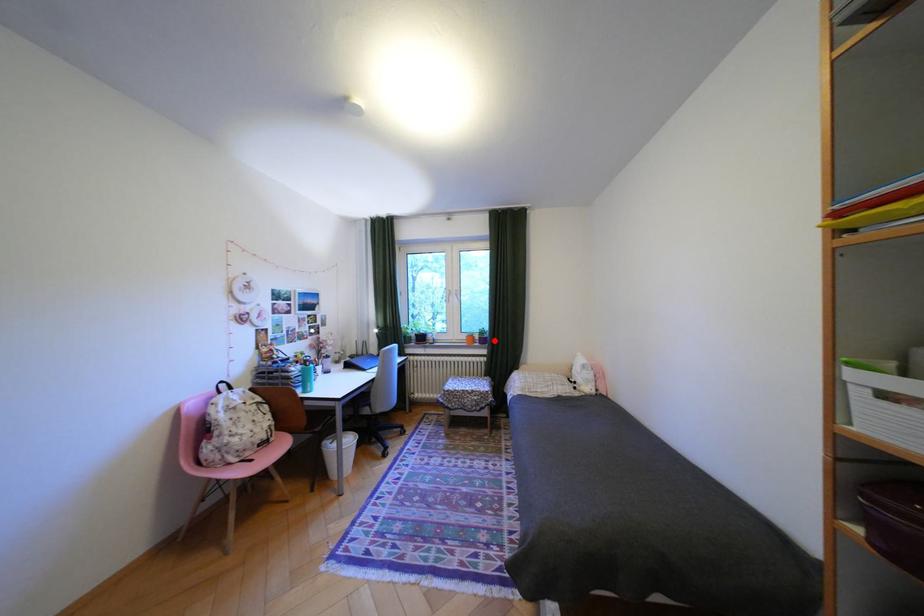
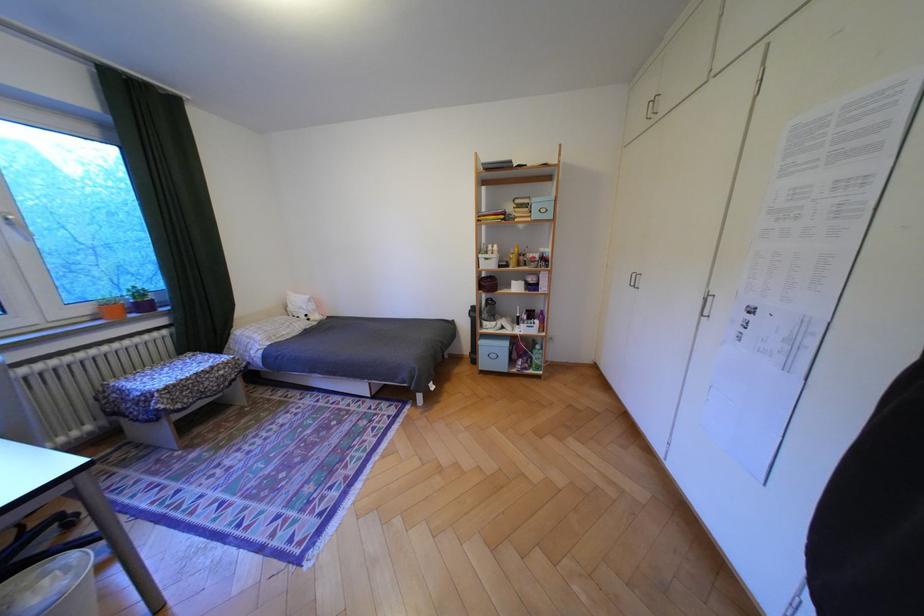
Question: I am providing you with two images of the same scene from different viewpoints. A red point is marked on the first image. Can you still see the location of the red point in image 2?

Choices:
 (A) Yes
 (B) No

Answer: (A)